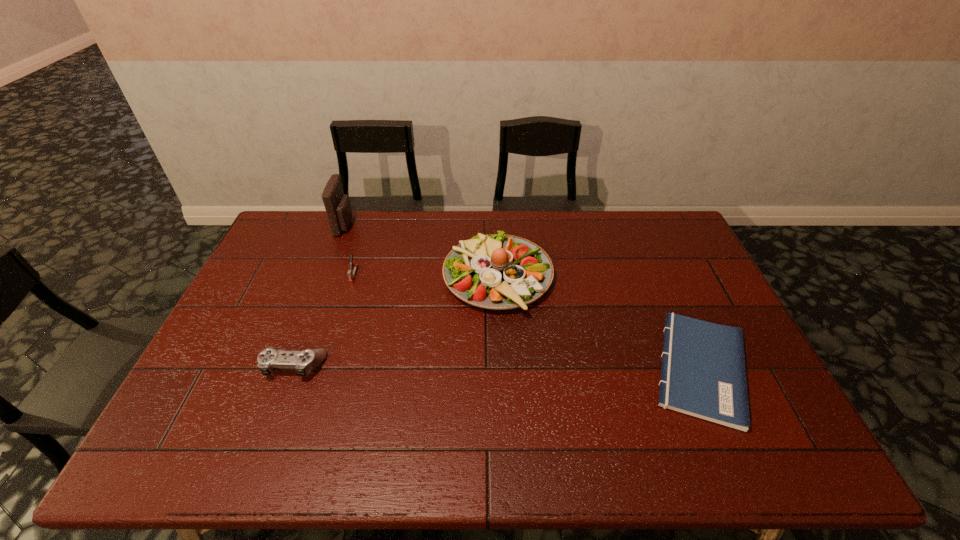
You are a GUI agent. You are given a task and a screenshot of the screen. Output one action in this format:
    pyautogui.click(x=<x>, y=<y>)
    Task: Click on the free spot that satisfies the following two spatial constraints: 1. with an open flap on the pouch; 2. on the right side of the paperback book
    This screenshot has width=960, height=540.
    Given the screenshot: What is the action you would take?
    pyautogui.click(x=292, y=368)

Identify the location of vacant space that satisfies the following two spatial constraints: 1. with an open flap on the pouch; 2. on the back side of the fourth object from left to right. (325, 277).

Identify the location of vacant space that satisfies the following two spatial constraints: 1. on the front side of the shortest object; 2. on the right side of the fourth object from left to right. The width and height of the screenshot is (960, 540). (502, 368).

Image resolution: width=960 pixels, height=540 pixels. Identify the location of free spot that satisfies the following two spatial constraints: 1. with an open flap on the pouch; 2. on the left side of the fourth shortest object. (325, 277).

The image size is (960, 540). Identify the location of free space that satisfies the following two spatial constraints: 1. with an open flap on the pouch; 2. on the back side of the second shortest object. tap(292, 366).